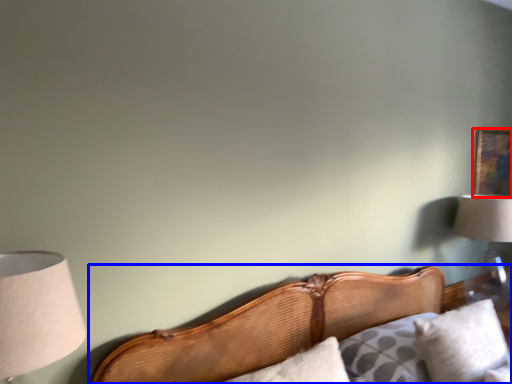
Question: Which object appears closest to the camera in this image, picture frame (highlighted by a red box) or bed (highlighted by a blue box)?

Choices:
 (A) picture frame
 (B) bed

Answer: (B)